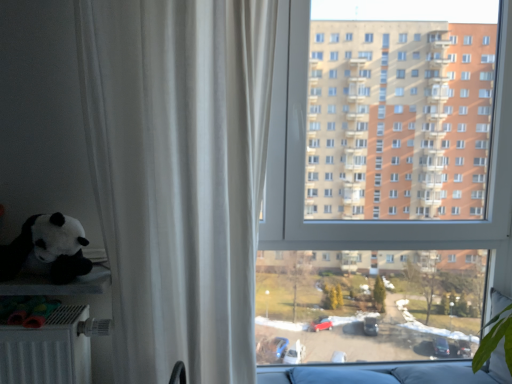
Question: From a real-world perspective, is transparent glass window at center on top of white sheer curtain at left?

Choices:
 (A) yes
 (B) no

Answer: (B)

Question: Can you confirm if transparent glass window at center is thinner than white sheer curtain at left?

Choices:
 (A) no
 (B) yes

Answer: (B)

Question: Can you confirm if transparent glass window at center is positioned to the left of white sheer curtain at left?

Choices:
 (A) no
 (B) yes

Answer: (A)

Question: Can white sheer curtain at left be found inside transparent glass window at center?

Choices:
 (A) yes
 (B) no

Answer: (B)

Question: Is transparent glass window at center outside white sheer curtain at left?

Choices:
 (A) yes
 (B) no

Answer: (A)

Question: Can you confirm if transparent glass window at center is shorter than white sheer curtain at left?

Choices:
 (A) no
 (B) yes

Answer: (A)

Question: Is matte black plush panda at left located outside white sheer curtain at left?

Choices:
 (A) no
 (B) yes

Answer: (B)

Question: Is matte black plush panda at left wider than white sheer curtain at left?

Choices:
 (A) yes
 (B) no

Answer: (B)

Question: Could you tell me if matte black plush panda at left is facing white sheer curtain at left?

Choices:
 (A) no
 (B) yes

Answer: (A)

Question: Is the depth of matte black plush panda at left greater than that of white sheer curtain at left?

Choices:
 (A) yes
 (B) no

Answer: (A)

Question: Is matte black plush panda at left at the right side of white sheer curtain at left?

Choices:
 (A) no
 (B) yes

Answer: (A)

Question: Is matte black plush panda at left smaller than white sheer curtain at left?

Choices:
 (A) no
 (B) yes

Answer: (B)

Question: Is white sheer curtain at left taller than matte black plush panda at left?

Choices:
 (A) yes
 (B) no

Answer: (A)